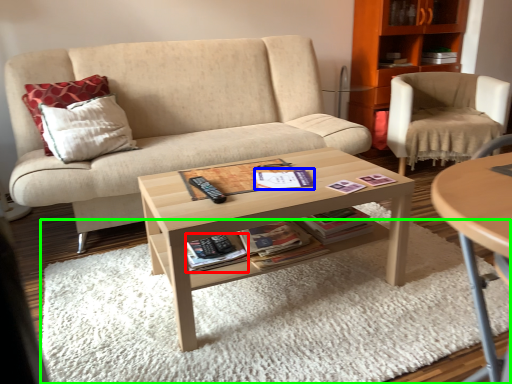
Question: Considering the real-world distances, which object is closest to paperback book (highlighted by a red box)? book (highlighted by a blue box) or plain (highlighted by a green box).

Choices:
 (A) book
 (B) plain

Answer: (A)